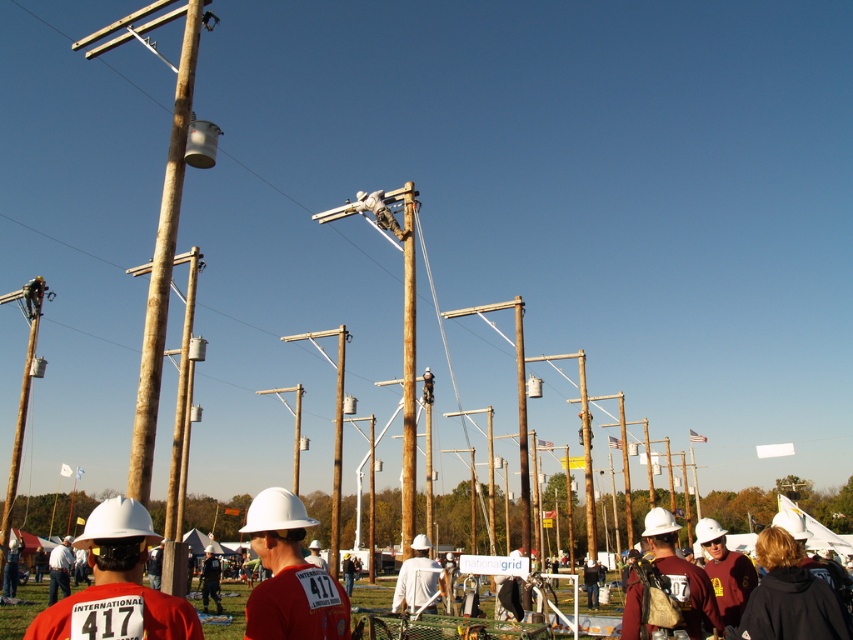
Question: Does rusty wood telegraph pole at upper center appear on the left side of white hard hat at center?

Choices:
 (A) yes
 (B) no

Answer: (B)

Question: Can you confirm if matte white hard hat at lower right is positioned to the right of white hard hat at center?

Choices:
 (A) yes
 (B) no

Answer: (A)

Question: Which object is the closest to the matte white hard hat at lower right?

Choices:
 (A) white hard hat at center
 (B) matte maroon shirt at lower right
 (C) rusty wood telegraph pole at upper center

Answer: (B)

Question: Which of the following is the farthest from the observer?

Choices:
 (A) rusty wood telegraph pole at upper center
 (B) matte white hard hat at lower right
 (C) matte maroon shirt at lower right

Answer: (A)

Question: Where is matte maroon shirt at lower right located in relation to white hard hat at center in the image?

Choices:
 (A) above
 (B) below

Answer: (A)

Question: Estimate the real-world distances between objects in this image. Which object is farther from the matte white hard hat at lower right?

Choices:
 (A) rusty wood telegraph pole at upper center
 (B) white hard hat at center
 (C) brown wooden telegraph pole at center
 (D) matte maroon shirt at lower right

Answer: (C)